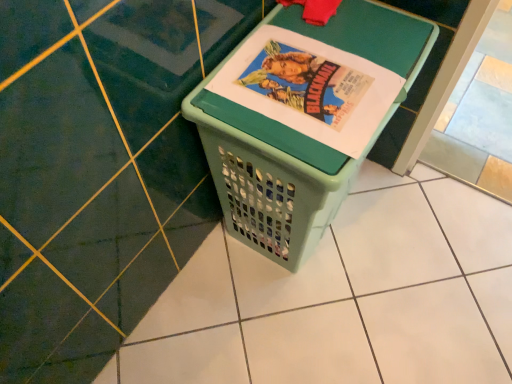
Where is `vacant area that is situated to the right of green plastic laundry basket at center`? Image resolution: width=512 pixels, height=384 pixels. vacant area that is situated to the right of green plastic laundry basket at center is located at coordinates (414, 239).